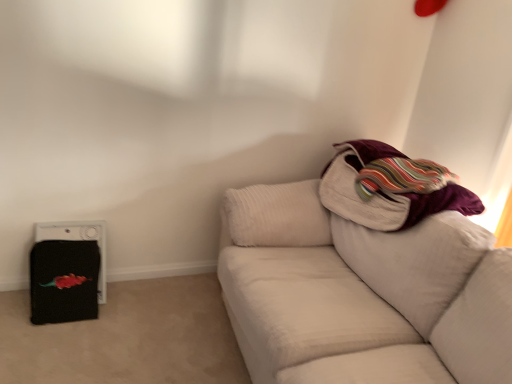
At what (x,y) coordinates should I click in order to perform the action: click on white textured couch at right. Please return your answer as a coordinate pair (x, y). Looking at the image, I should click on click(361, 294).

The height and width of the screenshot is (384, 512). What are the coordinates of `velvet purple blanket at upper right` in the screenshot? It's located at (384, 192).

The width and height of the screenshot is (512, 384). What do you see at coordinates (384, 192) in the screenshot?
I see `velvet purple blanket at upper right` at bounding box center [384, 192].

The height and width of the screenshot is (384, 512). Describe the element at coordinates (78, 240) in the screenshot. I see `black fabric at left` at that location.

Where is `black fabric at left`? Image resolution: width=512 pixels, height=384 pixels. black fabric at left is located at coordinates (78, 240).

This screenshot has width=512, height=384. I want to click on white textured couch at right, so click(361, 294).

Considering the points (41, 228) and (374, 376), which point is behind, point (41, 228) or point (374, 376)?

The point (41, 228) is behind.

How different are the orientations of black fabric at left and white textured couch at right in degrees?

The facing directions of black fabric at left and white textured couch at right are 90.3 degrees apart.

Consider the image. Can you confirm if black fabric at left is positioned to the right of white textured couch at right?

No.

Considering the sizes of black fabric at left and white textured couch at right in the image, is black fabric at left taller or shorter than white textured couch at right?

Considering their sizes, black fabric at left has less height than white textured couch at right.

From a real-world perspective, which is physically above, white textured couch at right or black fabric at left?

white textured couch at right.

What's the angular difference between white textured couch at right and black fabric at left's facing directions?

The facing directions of white textured couch at right and black fabric at left are 90.3 degrees apart.

Considering the positions of objects white textured couch at right and black fabric at left in the image provided, who is more to the right, white textured couch at right or black fabric at left?

Positioned to the right is white textured couch at right.

Is point (343, 373) positioned in front of point (88, 232)?

Yes, point (343, 373) is in front of point (88, 232).

Can you confirm if velvet purple blanket at upper right is smaller than white textured couch at right?

Yes, velvet purple blanket at upper right is smaller than white textured couch at right.

From the picture: Considering the sizes of objects velvet purple blanket at upper right and white textured couch at right in the image provided, who is taller, velvet purple blanket at upper right or white textured couch at right?

With more height is white textured couch at right.

Which is behind, point (403, 220) or point (366, 356)?

The point (403, 220) is behind.

From a real-world perspective, between velvet purple blanket at upper right and white textured couch at right, who is vertically lower?

In real-world perspective, white textured couch at right is lower.

Can you confirm if black fabric at left is positioned to the left of velvet purple blanket at upper right?

Indeed, black fabric at left is positioned on the left side of velvet purple blanket at upper right.

Where is `appliance on the left of velvet purple blanket at upper right`? The width and height of the screenshot is (512, 384). appliance on the left of velvet purple blanket at upper right is located at coordinates (78, 240).

Is point (80, 235) closer to camera compared to point (413, 210)?

No, (80, 235) is behind (413, 210).

From a real-world perspective, is black fabric at left located higher than velvet purple blanket at upper right?

Incorrect, from a real-world perspective, black fabric at left is lower than velvet purple blanket at upper right.

From a real-world perspective, between white textured couch at right and velvet purple blanket at upper right, who is vertically higher?

From a 3D spatial view, velvet purple blanket at upper right is above.

Are white textured couch at right and velvet purple blanket at upper right making contact?

No, white textured couch at right is not next to velvet purple blanket at upper right.

Considering the points (274, 358) and (395, 203), which point is in front, point (274, 358) or point (395, 203)?

The point (274, 358) is closer to the camera.

Measure the distance from white textured couch at right to velvet purple blanket at upper right.

The distance of white textured couch at right from velvet purple blanket at upper right is 12.56 inches.

From a real-world perspective, is velvet purple blanket at upper right positioned under black fabric at left based on gravity?

No, from a real-world perspective, velvet purple blanket at upper right is not beneath black fabric at left.

Does point (338, 205) lie in front of point (71, 226)?

That is True.

Which of these two, velvet purple blanket at upper right or black fabric at left, is thinner?

black fabric at left is thinner.

Considering the sizes of velvet purple blanket at upper right and black fabric at left in the image, is velvet purple blanket at upper right bigger or smaller than black fabric at left?

Considering their sizes, velvet purple blanket at upper right takes up more space than black fabric at left.

This screenshot has height=384, width=512. I want to click on appliance that is behind the white textured couch at right, so [78, 240].

Locate an element on the screen. This screenshot has height=384, width=512. studio couch lying below the black fabric at left (from the image's perspective) is located at coordinates (361, 294).

Considering their positions, is black fabric at left positioned further to white textured couch at right than velvet purple blanket at upper right?

black fabric at left is further to white textured couch at right.

Which object lies further to the anchor point black fabric at left, velvet purple blanket at upper right or white textured couch at right?

velvet purple blanket at upper right is further to black fabric at left.

Looking at the image, which one is located further to black fabric at left, white textured couch at right or velvet purple blanket at upper right?

velvet purple blanket at upper right is further to black fabric at left.

Looking at the image, which one is located further to velvet purple blanket at upper right, white textured couch at right or black fabric at left?

Among the two, black fabric at left is located further to velvet purple blanket at upper right.

When comparing their distances from white textured couch at right, does velvet purple blanket at upper right or black fabric at left seem further?

black fabric at left.

Estimate the real-world distances between objects in this image. Which object is further from velvet purple blanket at upper right, black fabric at left or white textured couch at right?

black fabric at left.

Identify the location of studio couch between black fabric at left and velvet purple blanket at upper right from left to right. This screenshot has height=384, width=512. (361, 294).